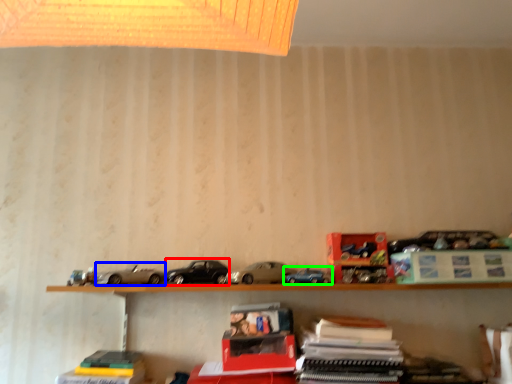
Question: Estimate the real-world distances between objects in this image. Which object is closer to car (highlighted by a red box), model car (highlighted by a blue box) or model car (highlighted by a green box)?

Choices:
 (A) model car
 (B) model car

Answer: (A)